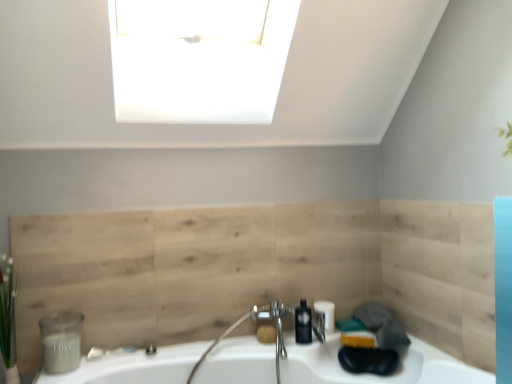
Find the location of a particular element. empty space that is ontop of natural wood paneling at center (from a real-world perspective) is located at coordinates (202, 202).